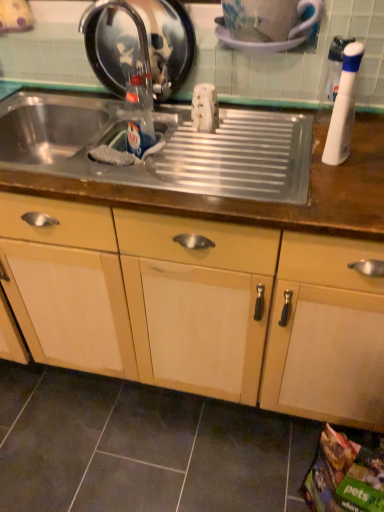
The width and height of the screenshot is (384, 512). Find the location of `vacant area in front of satin nickel faucet at upper left`. vacant area in front of satin nickel faucet at upper left is located at coordinates (138, 129).